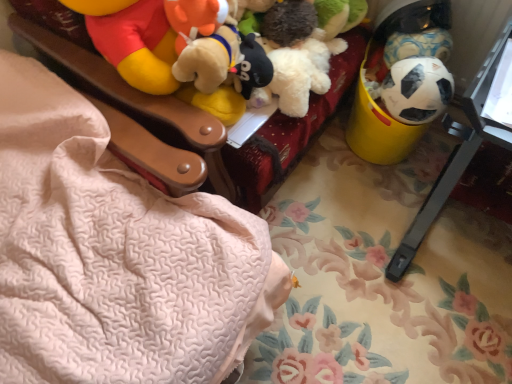
Question: Can yellow plastic bucket at right be found inside white matte soccer ball at right, which is the first toy in top-to-bottom order?

Choices:
 (A) no
 (B) yes

Answer: (A)

Question: Is white matte soccer ball at right, placed as the second toy when sorted from bottom to top, oriented towards yellow plastic bucket at right?

Choices:
 (A) yes
 (B) no

Answer: (B)

Question: Is white matte soccer ball at right, which is the first toy in top-to-bottom order, next to yellow plastic bucket at right and touching it?

Choices:
 (A) yes
 (B) no

Answer: (B)

Question: Does white matte soccer ball at right, which is the first toy in top-to-bottom order, appear on the left side of yellow plastic bucket at right?

Choices:
 (A) yes
 (B) no

Answer: (B)

Question: Is white matte soccer ball at right, placed as the second toy when sorted from bottom to top, not inside yellow plastic bucket at right?

Choices:
 (A) no
 (B) yes

Answer: (B)

Question: Does white matte soccer ball at right, which is the first toy in top-to-bottom order, appear on the right side of yellow plastic bucket at right?

Choices:
 (A) no
 (B) yes

Answer: (B)

Question: Can you confirm if white matte soccer ball at right, placed as the second toy when sorted from bottom to top, is shorter than yellow plastic changing table at right?

Choices:
 (A) no
 (B) yes

Answer: (B)

Question: From the image's perspective, is white matte soccer ball at right, placed as the second toy when sorted from bottom to top, located above yellow plastic changing table at right?

Choices:
 (A) yes
 (B) no

Answer: (A)

Question: Is white matte soccer ball at right, which is the first toy in top-to-bottom order, bigger than yellow plastic changing table at right?

Choices:
 (A) yes
 (B) no

Answer: (B)

Question: Is white matte soccer ball at right, which is the first toy in top-to-bottom order, positioned far away from yellow plastic changing table at right?

Choices:
 (A) yes
 (B) no

Answer: (B)

Question: Can we say white matte soccer ball at right, placed as the second toy when sorted from bottom to top, lies outside yellow plastic changing table at right?

Choices:
 (A) yes
 (B) no

Answer: (A)

Question: Is white matte soccer ball at right, placed as the second toy when sorted from bottom to top, smaller than yellow plastic changing table at right?

Choices:
 (A) yes
 (B) no

Answer: (A)

Question: From a real-world perspective, is yellow plastic changing table at right below black matte soccer ball at right, the 1th toy positioned from the bottom?

Choices:
 (A) no
 (B) yes

Answer: (B)